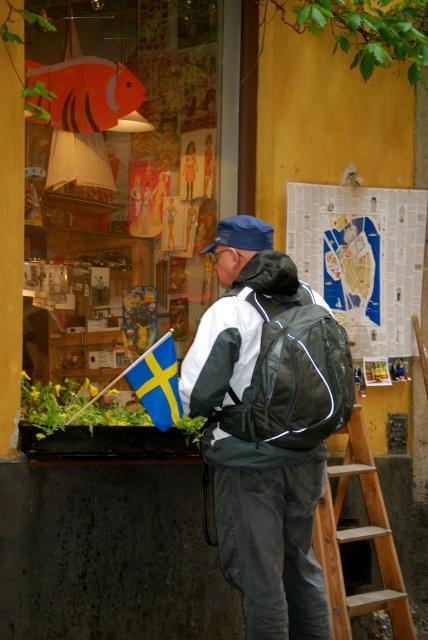
Question: Which point appears farthest from the camera in this image?

Choices:
 (A) (65, 74)
 (B) (172, 355)
 (C) (300, 314)
 (D) (366, 609)

Answer: (A)

Question: From the image, what is the correct spatial relationship of matte black backpack at center in relation to white matte jacket at center?

Choices:
 (A) right
 (B) left

Answer: (A)

Question: Does white paper map at upper right appear under green leafy plant at center?

Choices:
 (A) no
 (B) yes

Answer: (A)

Question: Which object is the farthest from the blue fabric flag at lower left?

Choices:
 (A) green leafy plant at center
 (B) orange matte fish at upper left

Answer: (B)

Question: Is matte black backpack at center closer to camera compared to green leafy plant at center?

Choices:
 (A) yes
 (B) no

Answer: (A)

Question: Among these points, which one is nearest to the camera?

Choices:
 (A) (241, 243)
 (B) (238, 460)
 (C) (341, 307)
 (D) (329, 540)

Answer: (B)